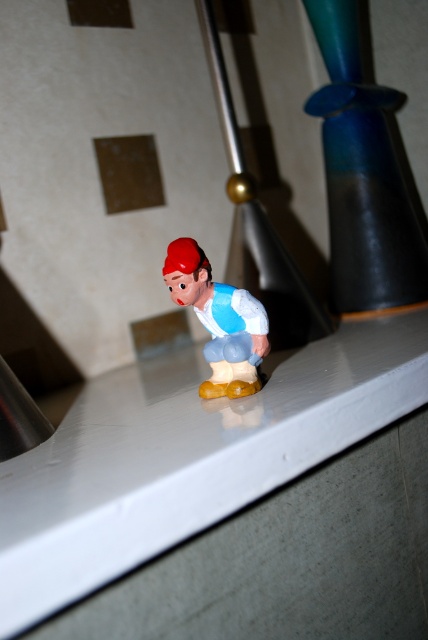
Can you confirm if white glossy counter top at center is bigger than matte plastic toy at center?

Correct, white glossy counter top at center is larger in size than matte plastic toy at center.

Is white glossy counter top at center shorter than matte plastic toy at center?

No, white glossy counter top at center is not shorter than matte plastic toy at center.

Which is in front, point (82, 540) or point (267, 337)?

Point (82, 540)

At what (x,y) coordinates should I click in order to perform the action: click on white glossy counter top at center. Please return your answer as a coordinate pair (x, y). The width and height of the screenshot is (428, 640). Looking at the image, I should click on (187, 456).